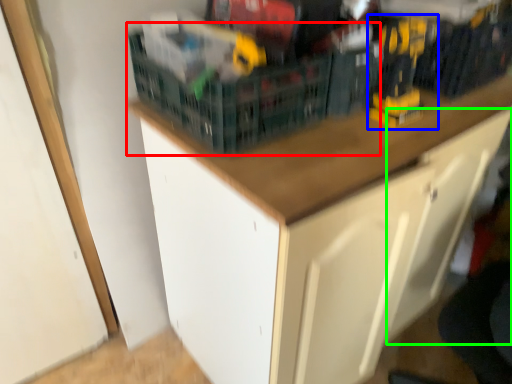
Question: Estimate the real-world distances between objects in this image. Which object is farther from basket (highlighted by a red box), toy (highlighted by a blue box) or drawer (highlighted by a green box)?

Choices:
 (A) toy
 (B) drawer

Answer: (B)